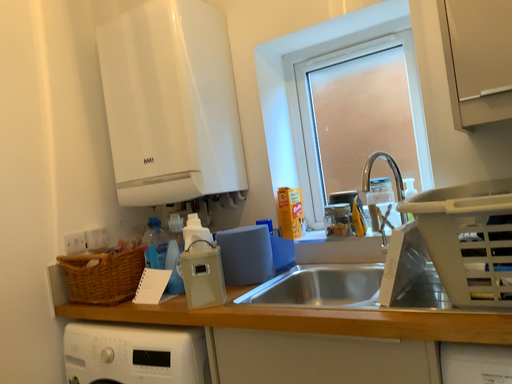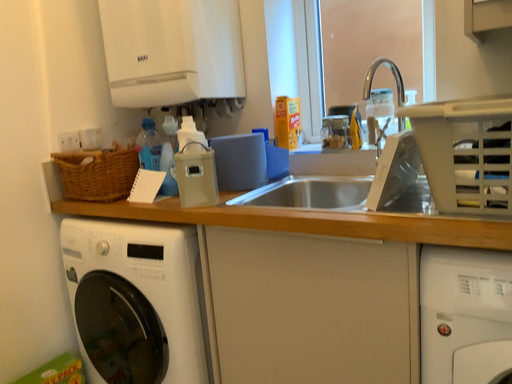
Question: Which way did the camera rotate in the video?

Choices:
 (A) rotated downward
 (B) rotated upward

Answer: (A)